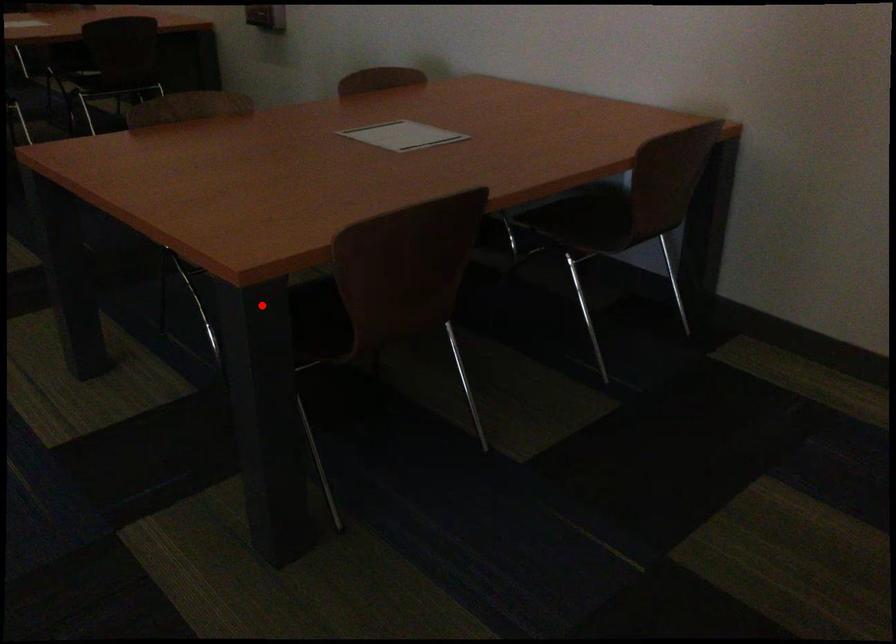
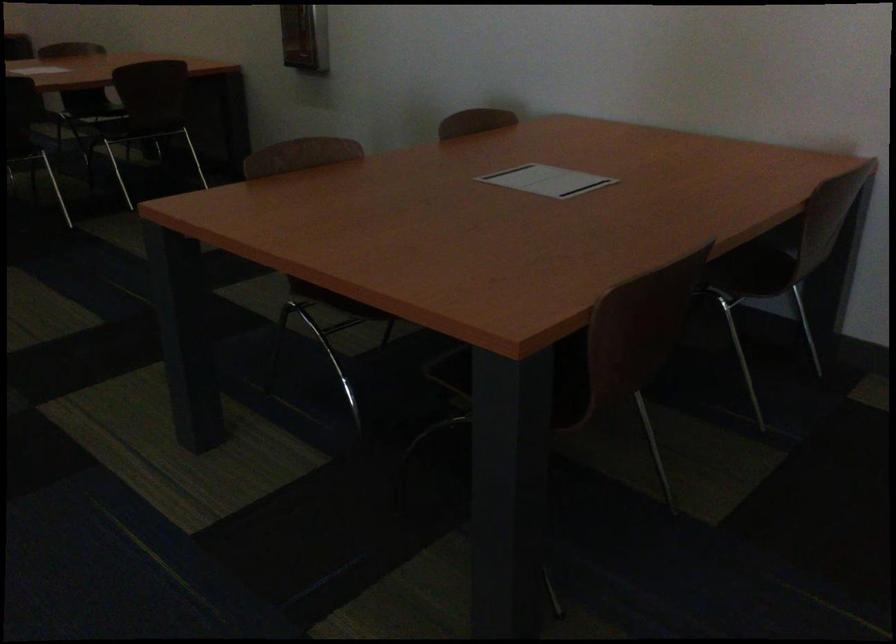
In the second image, find the point that corresponds to the highlighted location in the first image.

(526, 377)